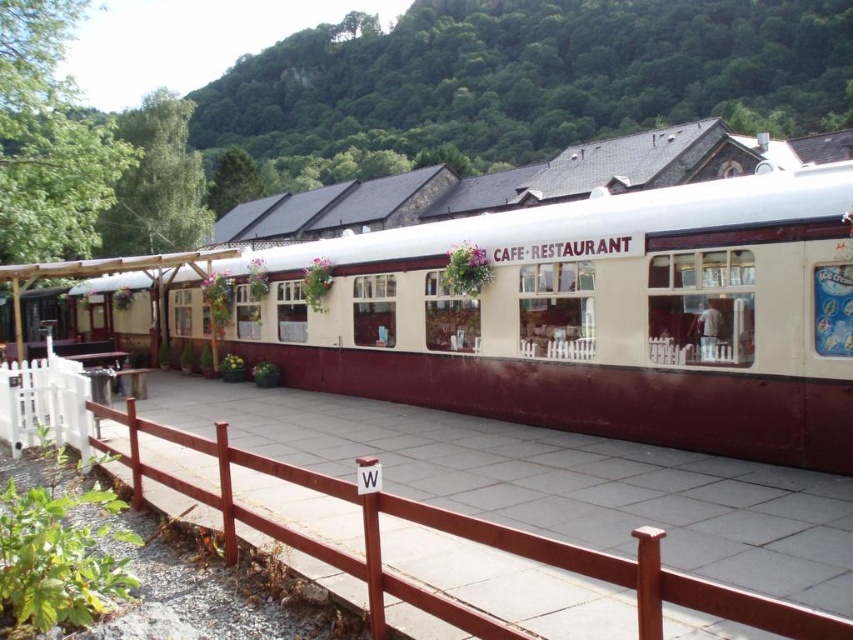
Question: Does white matte train car at center come behind brown wooden fence at center?

Choices:
 (A) no
 (B) yes

Answer: (B)

Question: Which of the following is the closest to the observer?

Choices:
 (A) white matte train car at center
 (B) brown wooden fence at center

Answer: (B)

Question: Does white matte train car at center appear on the right side of brown wooden fence at center?

Choices:
 (A) no
 (B) yes

Answer: (A)

Question: Can you confirm if white matte train car at center is positioned below brown wooden fence at center?

Choices:
 (A) no
 (B) yes

Answer: (A)

Question: Which point is closer to the camera taking this photo?

Choices:
 (A) (556, 394)
 (B) (403, 584)

Answer: (B)

Question: Which point is closer to the camera?

Choices:
 (A) white matte train car at center
 (B) brown wooden fence at center

Answer: (B)